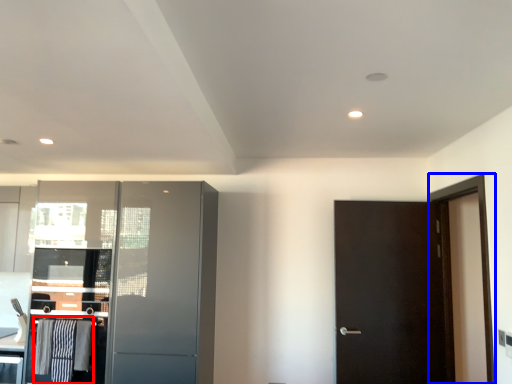
Question: Which object is closer to the camera taking this photo, laundry (highlighted by a red box) or screen door (highlighted by a blue box)?

Choices:
 (A) laundry
 (B) screen door

Answer: (B)